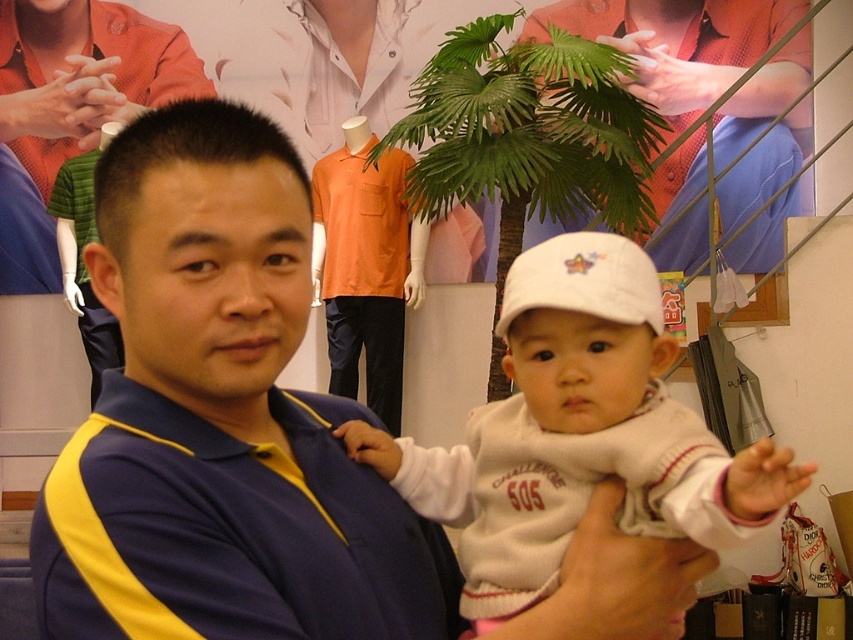
The image size is (853, 640). Describe the element at coordinates (219, 420) in the screenshot. I see `blue/yellow polo shirt at center` at that location.

Looking at this image, is blue/yellow polo shirt at center smaller than white fleece sweater at center?

Actually, blue/yellow polo shirt at center might be larger than white fleece sweater at center.

Where is `blue/yellow polo shirt at center`? The image size is (853, 640). blue/yellow polo shirt at center is located at coordinates (219, 420).

Is white fleece sweater at center taller than green leafy plant at upper center?

Incorrect, white fleece sweater at center's height is not larger of green leafy plant at upper center's.

Who is lower down, white fleece sweater at center or green leafy plant at upper center?

Positioned lower is white fleece sweater at center.

Is point (691, 445) in front of point (668, 240)?

That is True.

This screenshot has height=640, width=853. Identify the location of white fleece sweater at center. (577, 433).

Is point (177, 552) positioned before point (804, 29)?

Yes, it is in front of point (804, 29).

Between blue/yellow polo shirt at center and green leafy plant at upper center, which one is positioned higher?

green leafy plant at upper center is above.

Is point (138, 493) less distant than point (724, 252)?

Yes, point (138, 493) is in front of point (724, 252).

I want to click on blue/yellow polo shirt at center, so click(219, 420).